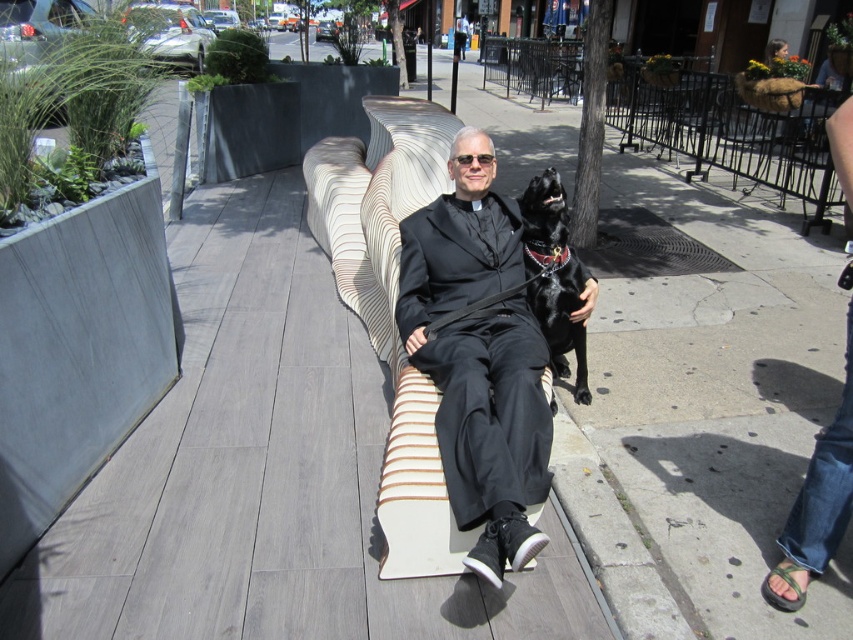
Question: Does black matte suit at center appear on the right side of black leather dog at center?

Choices:
 (A) no
 (B) yes

Answer: (A)

Question: Which point is farther to the camera?

Choices:
 (A) black leather dog at center
 (B) black matte suit at center

Answer: (A)

Question: Which point is closer to the camera?

Choices:
 (A) black matte suit at center
 (B) black leather dog at center

Answer: (A)

Question: Considering the relative positions of black matte suit at center and black leather dog at center in the image provided, where is black matte suit at center located with respect to black leather dog at center?

Choices:
 (A) right
 (B) left

Answer: (B)

Question: Among these points, which one is farthest from the camera?

Choices:
 (A) (563, 193)
 (B) (497, 349)

Answer: (A)

Question: Is the position of black matte suit at center more distant than that of black leather dog at center?

Choices:
 (A) no
 (B) yes

Answer: (A)